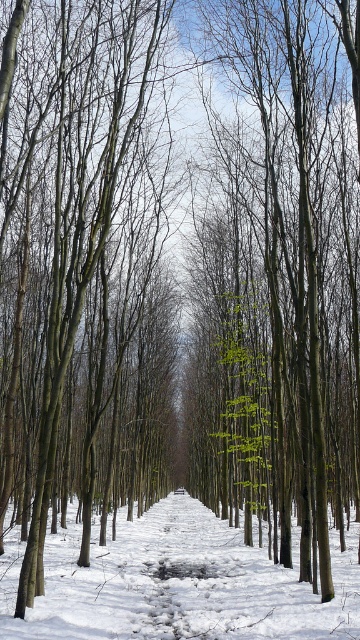
You are a hiker standing on the path in the winter forest scene. You notice a brown smooth tree at center and a white powdery snow at center. Which object is narrower in width?

The brown smooth tree at center is thinner than the white powdery snow at center, so the brown smooth tree at center is narrower in width.

Looking at this image, you are walking along the path in the winter forest scene and notice the green leafy tree at center and the white powdery snow at center. Which object is closer to you?

The green leafy tree at center is closer to you because it is positioned further to the viewer than the white powdery snow at center.

You are standing at the edge of the path in this winter forest scene. You notice the brown smooth tree at center and the white powdery snow at center. Which object is positioned to the left of the other?

The brown smooth tree at center is to the left of the white powdery snow at center.